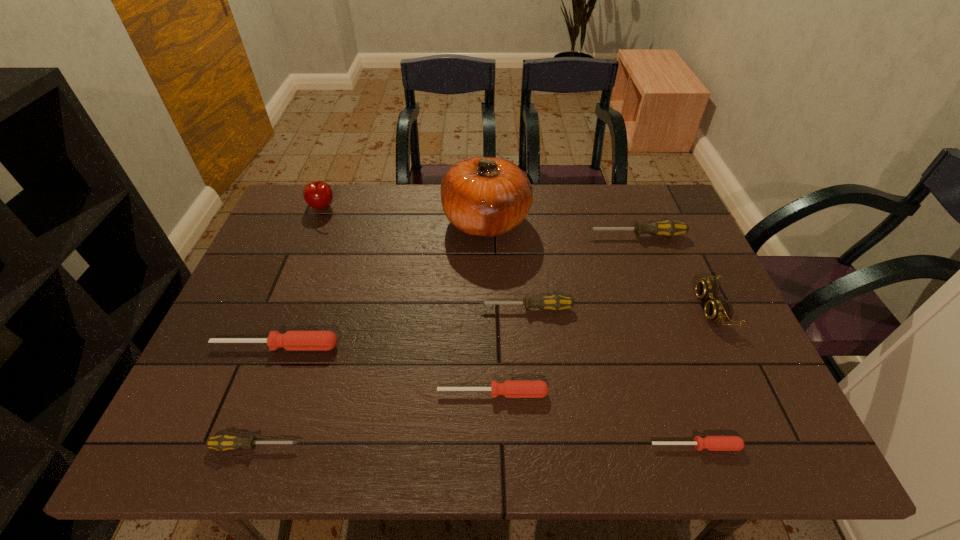
I want to click on free region at the far edge, so click(x=451, y=227).

At what (x,y) coordinates should I click in order to perform the action: click on free space at the near edge of the desktop. Please return your answer as a coordinate pair (x, y). The image size is (960, 540). Looking at the image, I should click on (472, 446).

At what (x,y) coordinates should I click in order to perform the action: click on vacant position at the left edge of the desktop. Please return your answer as a coordinate pair (x, y). Looking at the image, I should click on (254, 376).

In the image, there is a desktop. Where is `vacant space at the right edge`? The width and height of the screenshot is (960, 540). vacant space at the right edge is located at coordinates (681, 237).

The height and width of the screenshot is (540, 960). What are the coordinates of `vacant area at the near left corner of the desktop` in the screenshot? It's located at (251, 426).

Identify the location of vacant space at the far right corner of the desktop. The image size is (960, 540). (660, 194).

The width and height of the screenshot is (960, 540). In order to click on vacant space at the near right corner in this screenshot , I will do `click(766, 433)`.

Where is `blank region between the rightmost red screwdriver and the second farthest red screwdriver`? blank region between the rightmost red screwdriver and the second farthest red screwdriver is located at coordinates (594, 420).

Image resolution: width=960 pixels, height=540 pixels. In order to click on unoccupied area between the shortest object and the fourth farthest screwdriver in this screenshot , I will do `click(594, 420)`.

Locate an element on the screen. vacant area that lies between the second farthest gray screwdriver and the second farthest red screwdriver is located at coordinates (510, 350).